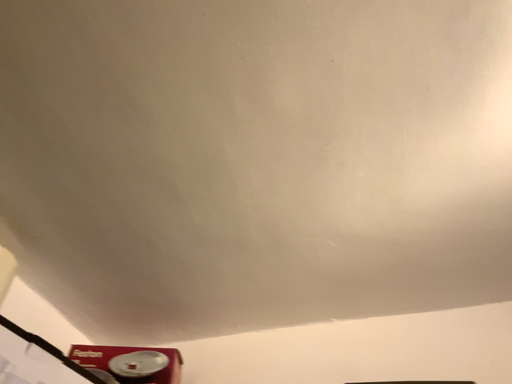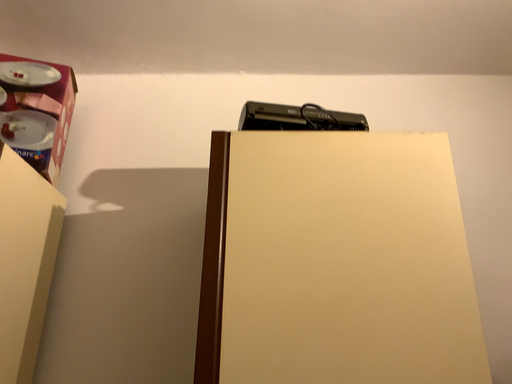
Question: How did the camera likely rotate when shooting the video?

Choices:
 (A) rotated upward
 (B) rotated downward

Answer: (B)